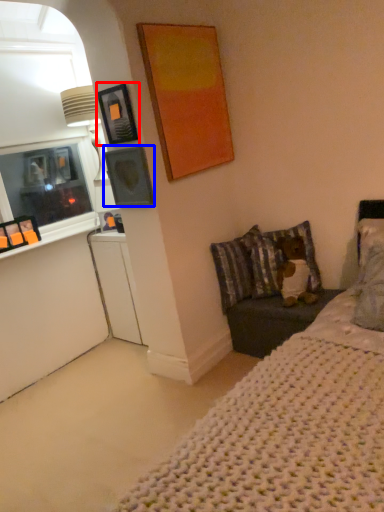
Question: Which object appears closest to the camera in this image, picture frame (highlighted by a red box) or picture frame (highlighted by a blue box)?

Choices:
 (A) picture frame
 (B) picture frame

Answer: (A)